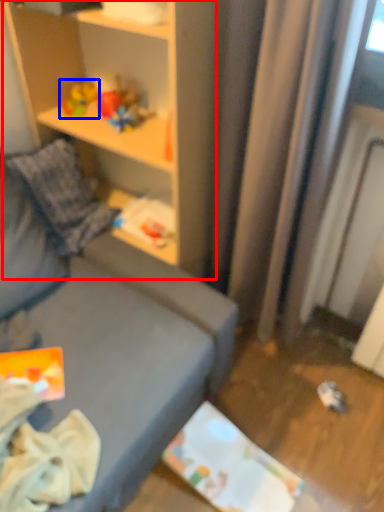
Question: Which point is closer to the camera, shelf (highlighted by a red box) or toy (highlighted by a blue box)?

Choices:
 (A) shelf
 (B) toy

Answer: (A)